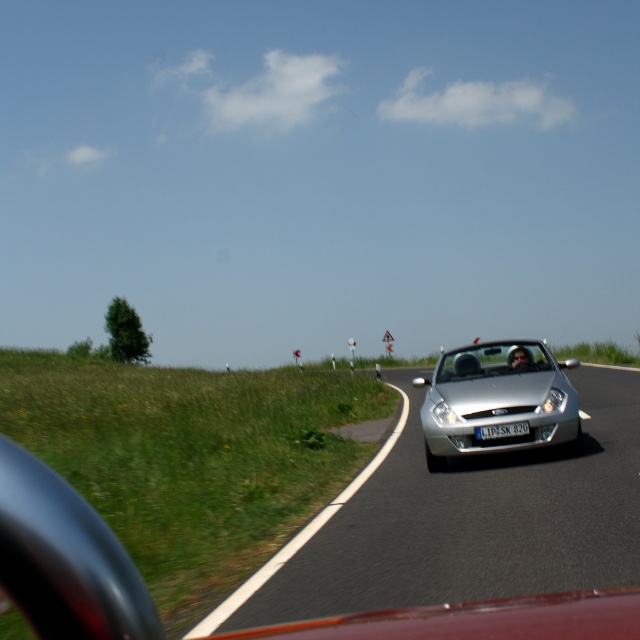
Question: Which point is closer to the camera?

Choices:
 (A) (477, 490)
 (B) (545, 432)

Answer: (A)

Question: Where is silver metallic car at center located in relation to silver metallic convertible at center in the image?

Choices:
 (A) above
 (B) below

Answer: (B)

Question: Is silver metallic car at center behind silver metallic convertible at center?

Choices:
 (A) yes
 (B) no

Answer: (B)

Question: Which object is closer to the camera taking this photo?

Choices:
 (A) silver metallic convertible at center
 (B) silver metallic car at center

Answer: (B)

Question: Can you confirm if silver metallic car at center is wider than silver metallic convertible at center?

Choices:
 (A) yes
 (B) no

Answer: (B)